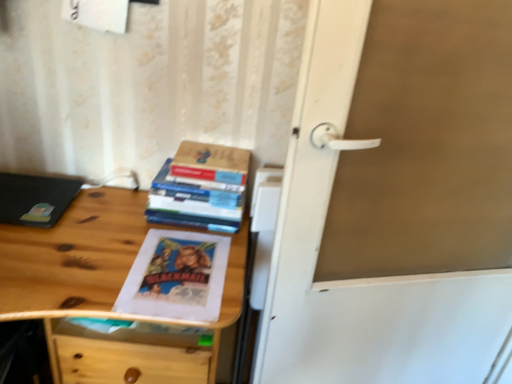
Identify the location of vacant space that is in between matte black laptop at left and hardcover books at center. (117, 216).